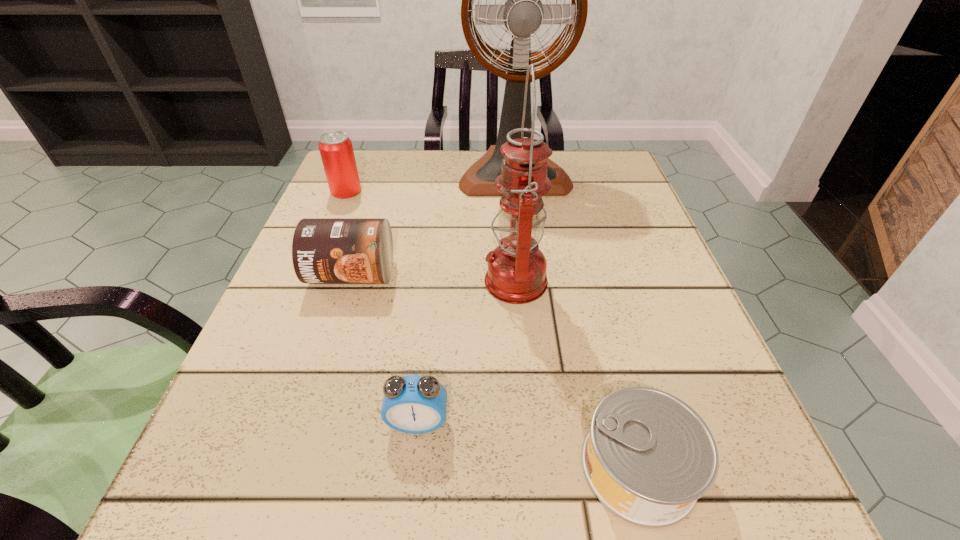
Point out which can is positioned as the second nearest to the fifth shortest object. Please provide its 2D coordinates. Your answer should be formatted as a tuple, i.e. [(x, y)], where the tuple contains the x and y coordinates of a point satisfying the conditions above.

[(648, 457)]

You are a GUI agent. You are given a task and a screenshot of the screen. Output one action in this format:
    pyautogui.click(x=<x>, y=<y>)
    Task: Click on the closest can to the second shortest can
    The width and height of the screenshot is (960, 540).
    Given the screenshot: What is the action you would take?
    pyautogui.click(x=336, y=150)

The width and height of the screenshot is (960, 540). What are the coordinates of `free space in the image that satisfies the following two spatial constraints: 1. on the face of the fifth tallest object; 2. on the right side of the shortest can` in the screenshot? It's located at (413, 467).

Find the location of `free spot that satisfies the following two spatial constraints: 1. on the front label of the second shortest can; 2. on the left side of the oil lamp`. free spot that satisfies the following two spatial constraints: 1. on the front label of the second shortest can; 2. on the left side of the oil lamp is located at coordinates (349, 280).

You are a GUI agent. You are given a task and a screenshot of the screen. Output one action in this format:
    pyautogui.click(x=<x>, y=<y>)
    Task: Click on the vacant space that satisfies the following two spatial constraints: 1. on the front label of the second shortest can; 2. on the right side of the shortest object
    This screenshot has height=540, width=960.
    Given the screenshot: What is the action you would take?
    pyautogui.click(x=291, y=467)

This screenshot has width=960, height=540. Find the location of `free space that satisfies the following two spatial constraints: 1. on the front side of the fifth shortest object; 2. on the left side of the tallest can`. free space that satisfies the following two spatial constraints: 1. on the front side of the fifth shortest object; 2. on the left side of the tallest can is located at coordinates (310, 280).

Where is `vacant space that satisfies the following two spatial constraints: 1. on the face of the shortest can; 2. on the left side of the alarm clock`? vacant space that satisfies the following two spatial constraints: 1. on the face of the shortest can; 2. on the left side of the alarm clock is located at coordinates (413, 467).

Image resolution: width=960 pixels, height=540 pixels. I want to click on vacant space that satisfies the following two spatial constraints: 1. on the front label of the third shortest object; 2. on the right side of the second tallest object, so click(x=349, y=280).

The width and height of the screenshot is (960, 540). I want to click on free region that satisfies the following two spatial constraints: 1. on the face of the alarm clock; 2. on the right side of the shortest object, so 413,467.

Locate an element on the screen. free location that satisfies the following two spatial constraints: 1. on the front label of the second farthest can; 2. on the left side of the shortest object is located at coordinates (291, 467).